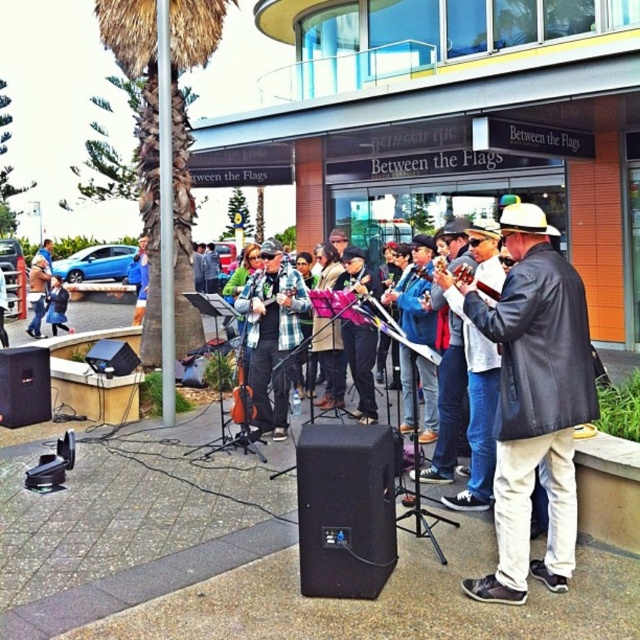
You are a photographer standing in front of the Between the Flags building. You want to take a photo that includes both the green leafy palm tree at left and the matte black jacket at center. Will the palm tree appear taller than the jacket in your photo?

The green leafy palm tree at left is above matte black jacket at center, so yes, the palm tree will appear taller than the matte black jacket at center in the photo.